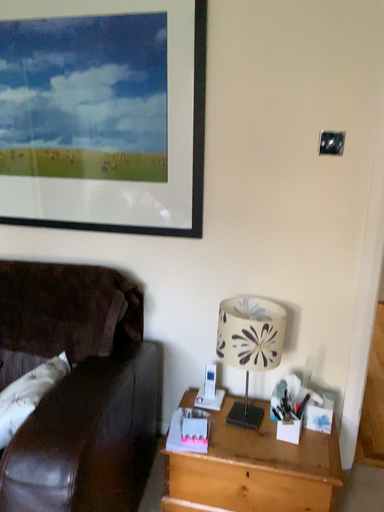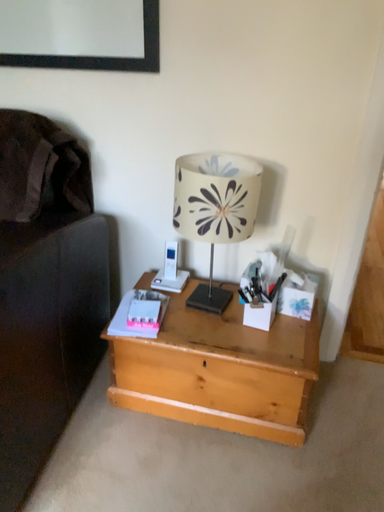
Question: Which way did the camera rotate in the video?

Choices:
 (A) rotated upward
 (B) rotated downward

Answer: (B)